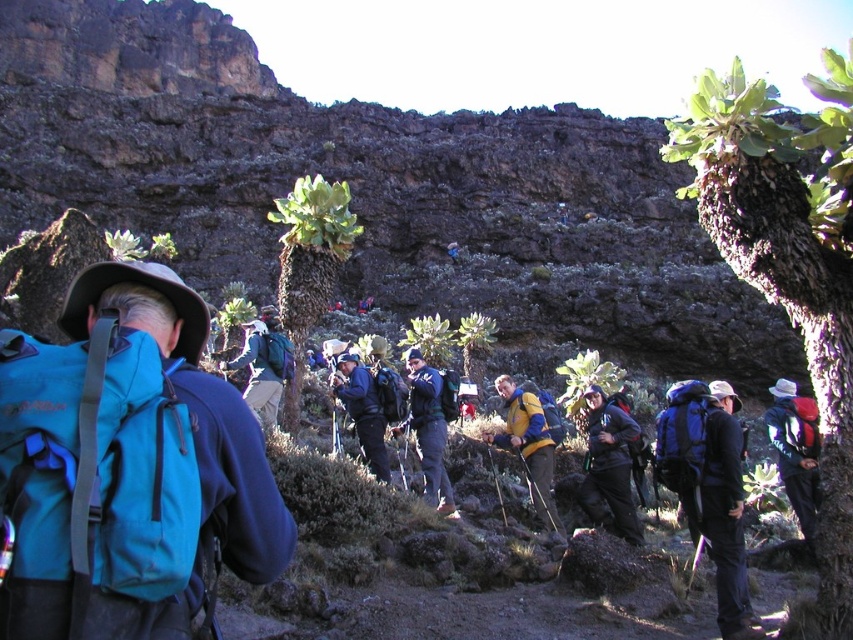
You are a hiker trying to navigate the rugged terrain. You see two points marked on the map at coordinates point (531, 426) and point (247, 340). Which point is closer to your current position if you are standing at the camera position?

Point (531, 426) is closer to the camera than point (247, 340), so the point closer to your current position is point (531, 426).

You are a hiker planning to cross a narrow rocky path. You have the yellowmaterialjacket at center and the teal fabric backpack at center. Which item should you choose to carry if you need something that takes up less space?

The yellowmaterialjacket at center is thinner than the teal fabric backpack at center, so you should choose the yellowmaterialjacket at center as it takes up less space.